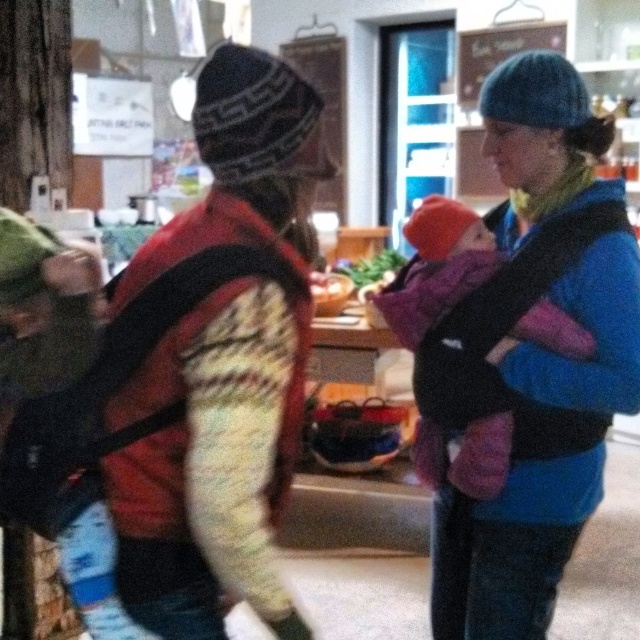
Locate an element on the screen. This screenshot has height=640, width=640. blue knitted hat at upper right is located at coordinates (540, 353).

Is point (620, 314) behind point (496, 410)?

No, it is not.

Describe the element at coordinates (540, 353) in the screenshot. Image resolution: width=640 pixels, height=640 pixels. I see `blue knitted hat at upper right` at that location.

In order to click on blue knitted hat at upper right in this screenshot , I will do `click(540, 353)`.